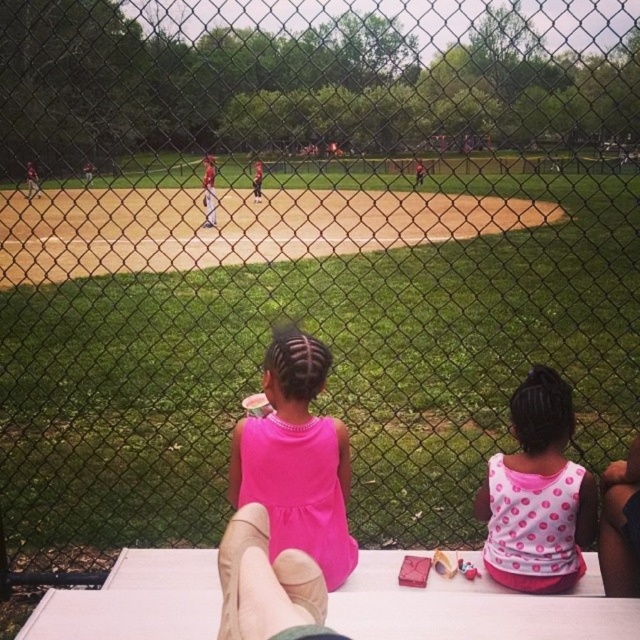
Is white wood picnic table at lower center positioned in front of pink matte dress at center?

Yes.

Does point (161, 624) come in front of point (310, 481)?

Yes, point (161, 624) is closer to viewer.

Locate an element on the screen. This screenshot has width=640, height=640. white wood picnic table at lower center is located at coordinates (472, 608).

Between white wood picnic table at lower center and pink polka dot tank top at center, which one is positioned higher?

pink polka dot tank top at center

Is point (61, 634) farther from viewer compared to point (556, 536)?

No, (61, 634) is in front of (556, 536).

Where is `white wood picnic table at lower center`? This screenshot has height=640, width=640. white wood picnic table at lower center is located at coordinates (472, 608).

Between pink matte dress at center and pink polka dot tank top at center, which one has less height?

pink polka dot tank top at center

Is point (305, 435) positioned in front of point (490, 515)?

That is True.

Which is behind, point (326, 548) or point (520, 480)?

Positioned behind is point (520, 480).

You are a GUI agent. You are given a task and a screenshot of the screen. Output one action in this format:
    pyautogui.click(x=<x>, y=<y>)
    Task: Click on the pink matte dress at center
    
    Given the screenshot: What is the action you would take?
    pyautogui.click(x=296, y=458)